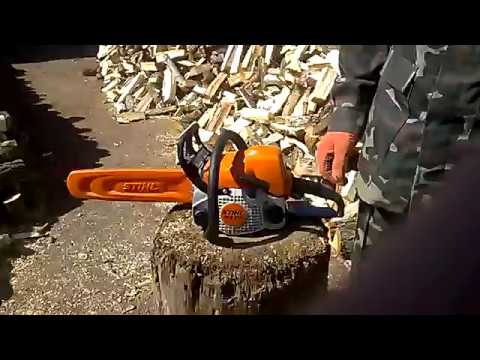
Locate an element on the screen. handle is located at coordinates (223, 146).